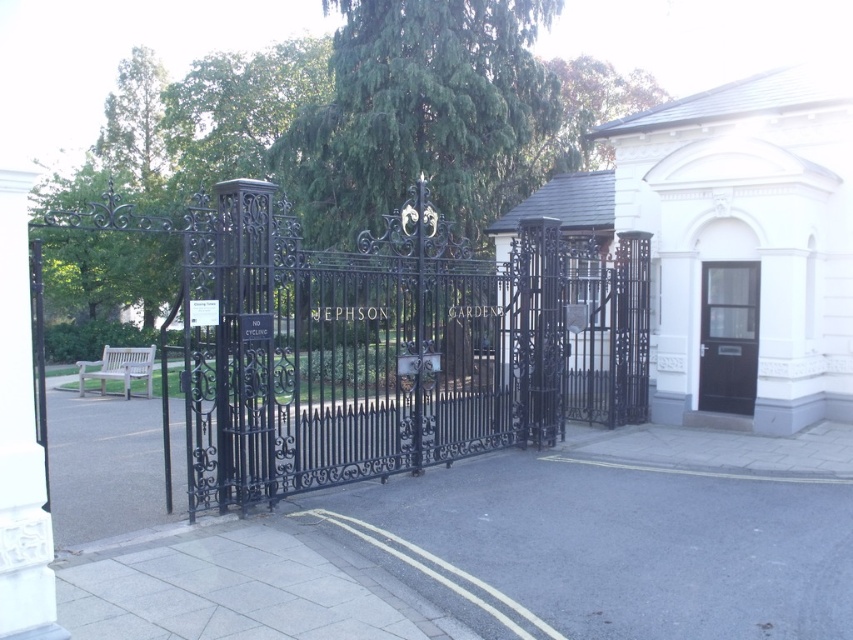
Is black wrought iron gate at center further to the viewer compared to black wooden door at right?

No.

Is black wrought iron gate at center shorter than black wooden door at right?

In fact, black wrought iron gate at center may be taller than black wooden door at right.

Does point (521, 432) come closer to viewer compared to point (704, 316)?

Yes.

Identify the location of black wrought iron gate at center. Image resolution: width=853 pixels, height=640 pixels. (387, 348).